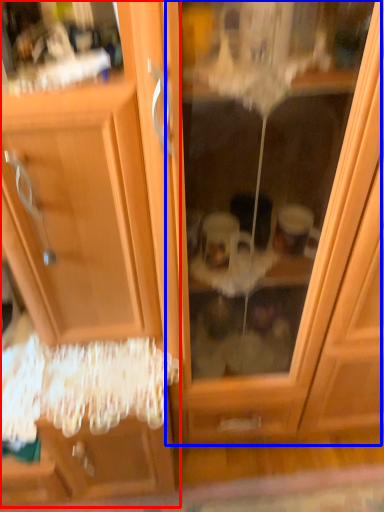
Question: Among these objects, which one is farthest to the camera, dresser (highlighted by a red box) or screen door (highlighted by a blue box)?

Choices:
 (A) dresser
 (B) screen door

Answer: (B)